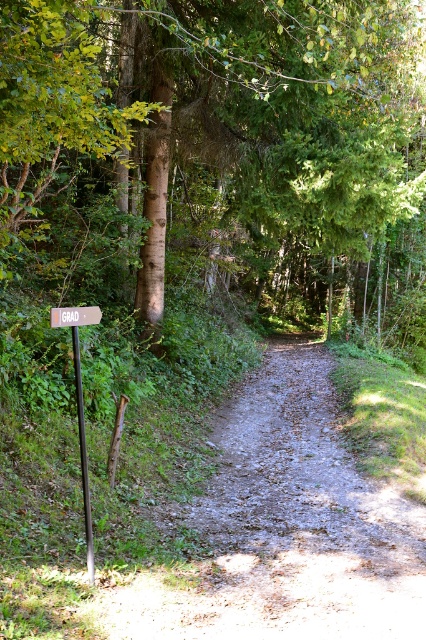
Does point (354, 301) come behind point (75, 308)?

Yes, point (354, 301) is farther from viewer.

How much distance is there between brown textured tree at left and wooden sign at center?

The distance of brown textured tree at left from wooden sign at center is 11.00 meters.

Between point (298, 90) and point (57, 323), which one is positioned behind?

Point (298, 90)

You are a GUI agent. You are given a task and a screenshot of the screen. Output one action in this format:
    pyautogui.click(x=<x>, y=<y>)
    Task: Click on the brown textured tree at left
    This screenshot has width=426, height=640.
    Given the screenshot: What is the action you would take?
    pyautogui.click(x=218, y=156)

Is wooden sign at center further to camera compared to brown rough wooden post at left?

No.

What do you see at coordinates (74, 316) in the screenshot? I see `wooden sign at center` at bounding box center [74, 316].

Between point (52, 317) and point (111, 461), which one is positioned behind?

The point (111, 461) is behind.

Where is `wooden sign at center`? wooden sign at center is located at coordinates (74, 316).

Which is in front, point (77, 342) or point (97, 307)?

Point (77, 342) is in front.

Is the position of orange wooden signpost at left less distant than that of wooden sign at center?

Yes, it is.

Which is in front, point (86, 476) or point (80, 314)?

Positioned in front is point (86, 476).

You are a GUI agent. You are given a task and a screenshot of the screen. Output one action in this format:
    pyautogui.click(x=<x>, y=<y>)
    Task: Click on the orange wooden signpost at left
    This screenshot has height=640, width=426.
    Given the screenshot: What is the action you would take?
    pyautogui.click(x=80, y=404)